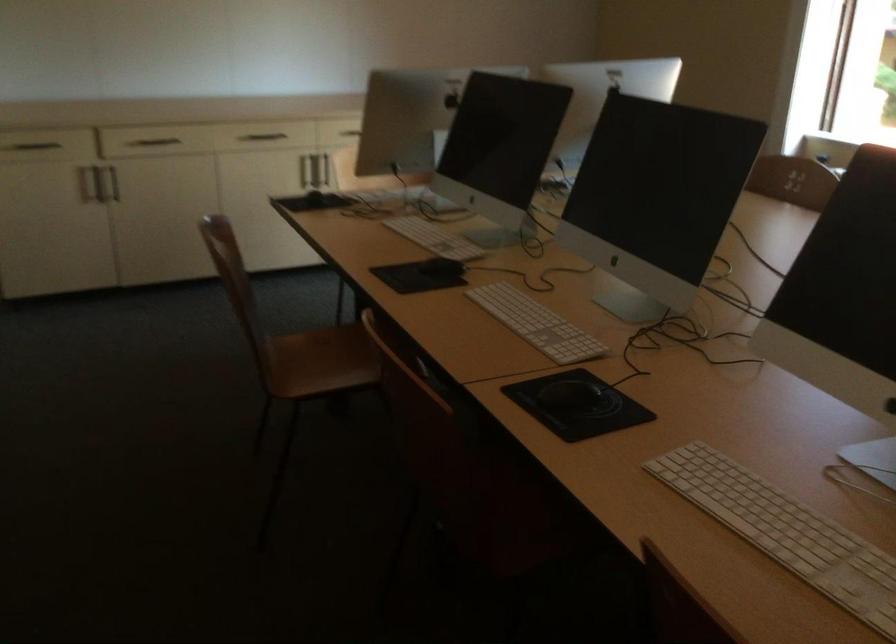
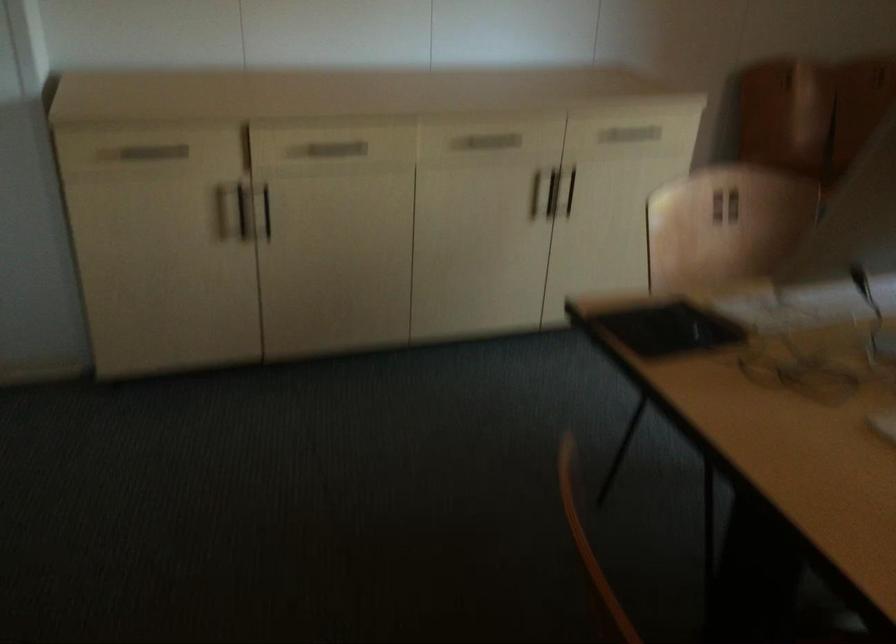
In a continuous first-person perspective shot, in which direction is the camera moving?

The cameraman walked toward left, forward.